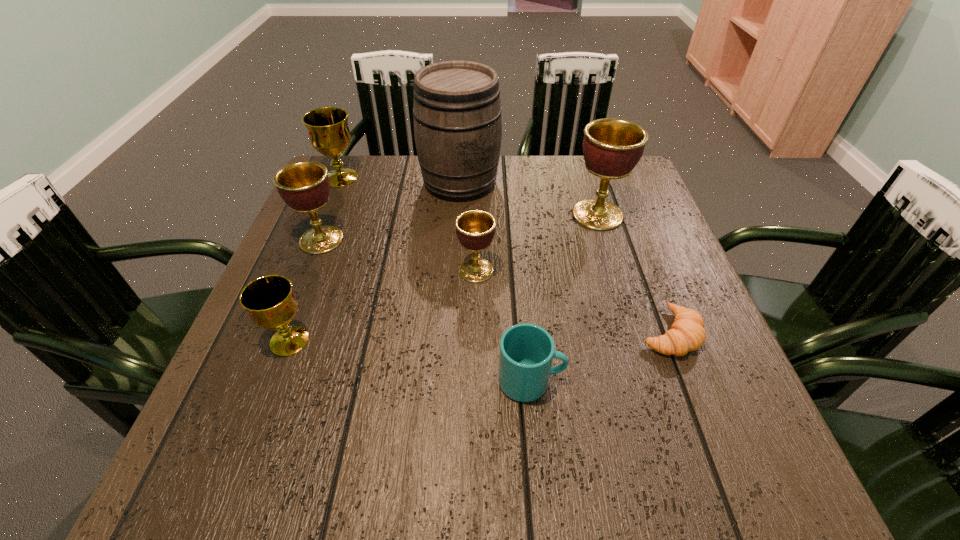
Find the location of a particular element. cup is located at coordinates (526, 354).

The image size is (960, 540). Find the location of `the shortest object`. the shortest object is located at coordinates (x=687, y=333).

Locate an element on the screen. blank space located on the front of the tallest object is located at coordinates (458, 220).

You are a GUI agent. You are given a task and a screenshot of the screen. Output one action in this format:
    pyautogui.click(x=<x>, y=<y>)
    Task: Click on the free space located 0.070m on the back of the tallest chalice
    Image resolution: width=960 pixels, height=540 pixels.
    Given the screenshot: What is the action you would take?
    pyautogui.click(x=588, y=184)

What are the coordinates of `free region located on the front of the farthest chalice` in the screenshot? It's located at (320, 228).

Find the location of a particular element. This screenshot has height=540, width=960. vacant region located 0.330m on the front of the leftmost golden chalice is located at coordinates (266, 382).

You are a GUI agent. You are given a task and a screenshot of the screen. Output one action in this format:
    pyautogui.click(x=<x>, y=<y>)
    Task: Click on the vacant point located on the front of the nearest chalice
    The image size is (960, 540).
    Given the screenshot: What is the action you would take?
    pyautogui.click(x=246, y=457)

This screenshot has height=540, width=960. Identify the location of free region located 0.300m on the back of the nearest golden chalice. (477, 184).

Where is `free space located on the handle side of the cup`? free space located on the handle side of the cup is located at coordinates (643, 381).

The width and height of the screenshot is (960, 540). I want to click on vacant area located 0.080m on the front of the crescent roll, so click(x=695, y=401).